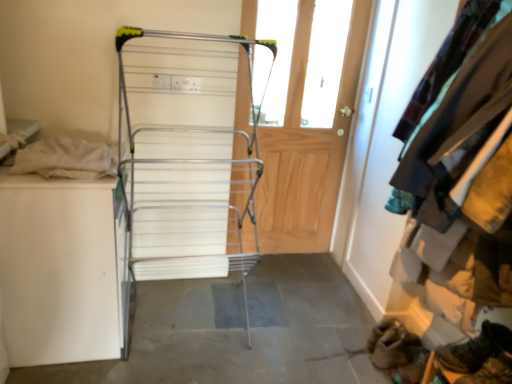
Locate an element on the screen. velvet teal jacket at upper right is located at coordinates (468, 163).

You are a GUI agent. You are given a task and a screenshot of the screen. Output one action in this format:
    pyautogui.click(x=<x>, y=<y>)
    Task: Click on the gray concrete floor at center
    The height and width of the screenshot is (384, 512).
    Given the screenshot: What is the action you would take?
    pyautogui.click(x=239, y=331)

The image size is (512, 384). What do you see at coordinates (239, 331) in the screenshot?
I see `gray concrete floor at center` at bounding box center [239, 331].

Where is `wooden door at center`? The height and width of the screenshot is (384, 512). wooden door at center is located at coordinates (307, 150).

The height and width of the screenshot is (384, 512). Find the location of `leather boot at lower right`. leather boot at lower right is located at coordinates (475, 348).

Considering the relative positions of wooden door at center and velvet teal jacket at upper right in the image provided, is wooden door at center to the left or to the right of velvet teal jacket at upper right?

wooden door at center is positioned on velvet teal jacket at upper right's left side.

Is wooden door at center completely or partially outside of velvet teal jacket at upper right?

That's correct, wooden door at center is outside of velvet teal jacket at upper right.

Is wooden door at center shorter than velvet teal jacket at upper right?

No, wooden door at center is not shorter than velvet teal jacket at upper right.

Between wooden door at center and velvet teal jacket at upper right, which one has larger width?

Wider between the two is velvet teal jacket at upper right.

How distant is wooden door at center from leather boot at lower right?

They are 4.83 feet apart.

Consider the image. From the image's perspective, between wooden door at center and leather boot at lower right, which one is located above?

wooden door at center, from the image's perspective.

Based on their sizes in the image, would you say wooden door at center is bigger or smaller than leather boot at lower right?

Clearly, wooden door at center is larger in size than leather boot at lower right.

Is wooden door at center aimed at leather boot at lower right?

Yes.

Can you tell me how much velvet teal jacket at upper right and gray concrete floor at center differ in facing direction?

The angle between the facing direction of velvet teal jacket at upper right and the facing direction of gray concrete floor at center is 91.3 degrees.

Which is correct: velvet teal jacket at upper right is inside gray concrete floor at center, or outside of it?

velvet teal jacket at upper right lies outside gray concrete floor at center.

Which of these two, velvet teal jacket at upper right or gray concrete floor at center, stands shorter?

Standing shorter between the two is gray concrete floor at center.

Looking at this image, would you say velvet teal jacket at upper right is part of silver metallic drying rack at center's contents?

No.

Can you tell me how much silver metallic drying rack at center and velvet teal jacket at upper right differ in facing direction?

There is a 91.9-degree angle between the facing directions of silver metallic drying rack at center and velvet teal jacket at upper right.

Is silver metallic drying rack at center directly adjacent to velvet teal jacket at upper right?

silver metallic drying rack at center and velvet teal jacket at upper right are clearly separated.

Which is more to the right, silver metallic drying rack at center or velvet teal jacket at upper right?

velvet teal jacket at upper right.

From a real-world perspective, which object rests below the other?

From a 3D spatial view, leather boot at lower right is below.

Which object is positioned more to the right, leather boot at lower right or silver metallic drying rack at center?

Positioned to the right is leather boot at lower right.

Which of these two, leather boot at lower right or silver metallic drying rack at center, is smaller?

leather boot at lower right is smaller.

Is leather boot at lower right positioned far away from silver metallic drying rack at center?

That's right, there is a large distance between leather boot at lower right and silver metallic drying rack at center.

How different are the orientations of leather boot at lower right and velvet teal jacket at upper right in degrees?

The angle between the facing direction of leather boot at lower right and the facing direction of velvet teal jacket at upper right is 10.9 degrees.

Does leather boot at lower right appear on the left side of velvet teal jacket at upper right?

Incorrect, leather boot at lower right is not on the left side of velvet teal jacket at upper right.

Is leather boot at lower right far away from velvet teal jacket at upper right?

Actually, leather boot at lower right and velvet teal jacket at upper right are a little close together.

From a real-world perspective, is leather boot at lower right positioned under velvet teal jacket at upper right based on gravity?

Yes, from a real-world perspective, leather boot at lower right is under velvet teal jacket at upper right.

Can you see silver metallic drying rack at center touching leather boot at lower right?

No, silver metallic drying rack at center is not making contact with leather boot at lower right.

What's the angular difference between silver metallic drying rack at center and leather boot at lower right's facing directions?

They differ by 103 degrees in their facing directions.

Identify the location of furniture on the left of the leather boot at lower right. The image size is (512, 384). (188, 154).

Which is correct: silver metallic drying rack at center is inside leather boot at lower right, or outside of it?

The correct answer is: outside.

I want to click on door located on the left of velvet teal jacket at upper right, so click(x=307, y=150).

In order to click on footwear below the wooden door at center (from a real-world perspective) in this screenshot , I will do `click(475, 348)`.

From the image, which object appears to be farther from velvet teal jacket at upper right, wooden door at center or silver metallic drying rack at center?

wooden door at center.

Which object lies further to the anchor point velvet teal jacket at upper right, silver metallic drying rack at center or wooden door at center?

wooden door at center.

Looking at the image, which one is located further to wooden door at center, gray concrete floor at center or leather boot at lower right?

leather boot at lower right.

Which object lies nearer to the anchor point silver metallic drying rack at center, wooden door at center or gray concrete floor at center?

Among the two, gray concrete floor at center is located nearer to silver metallic drying rack at center.

Which object lies nearer to the anchor point velvet teal jacket at upper right, leather boot at lower right or wooden door at center?

leather boot at lower right.

Based on their spatial positions, is wooden door at center or gray concrete floor at center closer to velvet teal jacket at upper right?

The object closer to velvet teal jacket at upper right is gray concrete floor at center.

Which object lies nearer to the anchor point leather boot at lower right, wooden door at center or gray concrete floor at center?

The object closer to leather boot at lower right is gray concrete floor at center.

Considering their positions, is gray concrete floor at center positioned closer to velvet teal jacket at upper right than silver metallic drying rack at center?

The object closer to velvet teal jacket at upper right is silver metallic drying rack at center.

I want to click on footwear between velvet teal jacket at upper right and wooden door at center from front to back, so click(x=475, y=348).

Where is `concrete between silver metallic drying rack at center and leather boot at lower right in the horizontal direction`? The width and height of the screenshot is (512, 384). concrete between silver metallic drying rack at center and leather boot at lower right in the horizontal direction is located at coordinates (239, 331).

Locate an element on the screen. This screenshot has width=512, height=384. concrete between silver metallic drying rack at center and velvet teal jacket at upper right in the horizontal direction is located at coordinates (239, 331).

Identify the location of furniture between wooden door at center and gray concrete floor at center vertically. (188, 154).